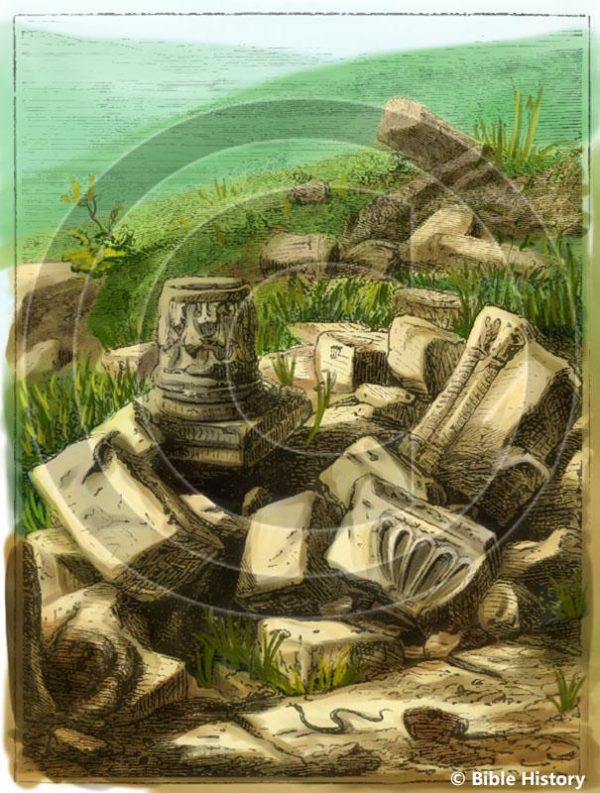
Identify the location of art. This screenshot has width=600, height=793. (283, 192).